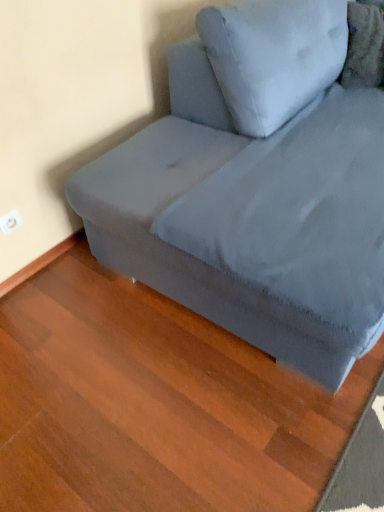
The width and height of the screenshot is (384, 512). Describe the element at coordinates (256, 189) in the screenshot. I see `velvet gray couch at upper right` at that location.

This screenshot has height=512, width=384. Identify the location of velvet gray couch at upper right. (256, 189).

Measure the distance between point (356, 63) and camera.

Point (356, 63) is 5.94 feet away from camera.

Locate an element on the screen. The width and height of the screenshot is (384, 512). velvety gray pillow at upper right is located at coordinates (364, 45).

What do you see at coordinates (364, 45) in the screenshot? The width and height of the screenshot is (384, 512). I see `velvety gray pillow at upper right` at bounding box center [364, 45].

Find the location of a particular element. The height and width of the screenshot is (512, 384). velvet gray couch at upper right is located at coordinates (256, 189).

Is velvety gray pillow at upper right at the right side of velvet gray couch at upper right?

Correct, you'll find velvety gray pillow at upper right to the right of velvet gray couch at upper right.

Is velvety gray pillow at upper right further to camera compared to velvet gray couch at upper right?

Yes, the depth of velvety gray pillow at upper right is greater than that of velvet gray couch at upper right.

Is point (378, 32) positioned in front of point (310, 236)?

No, (378, 32) is further to viewer.

From the image's perspective, is velvety gray pillow at upper right on velvet gray couch at upper right?

Indeed, from the image's perspective, velvety gray pillow at upper right is shown above velvet gray couch at upper right.

From a real-world perspective, between velvety gray pillow at upper right and velvet gray couch at upper right, who is vertically lower?

velvet gray couch at upper right.

Which of these two, velvety gray pillow at upper right or velvet gray couch at upper right, is thinner?

Thinner between the two is velvety gray pillow at upper right.

Considering the sizes of objects velvety gray pillow at upper right and velvet gray couch at upper right in the image provided, who is taller, velvety gray pillow at upper right or velvet gray couch at upper right?

velvet gray couch at upper right is taller.

Is velvety gray pillow at upper right bigger than velvet gray couch at upper right?

No.

Is velvety gray pillow at upper right inside or outside of velvet gray couch at upper right?

velvety gray pillow at upper right exists entirely within velvet gray couch at upper right.

From the picture: Is velvety gray pillow at upper right placed right next to velvet gray couch at upper right?

velvety gray pillow at upper right and velvet gray couch at upper right are clearly separated.

Could you tell me if velvety gray pillow at upper right is facing velvet gray couch at upper right?

Yes.

How much distance is there between velvety gray pillow at upper right and velvet gray couch at upper right?

velvety gray pillow at upper right and velvet gray couch at upper right are 26.85 inches apart.

The image size is (384, 512). I want to click on pillow above the velvet gray couch at upper right (from a real-world perspective), so click(x=364, y=45).

Considering the relative positions of velvet gray couch at upper right and velvety gray pillow at upper right in the image provided, is velvet gray couch at upper right to the right of velvety gray pillow at upper right from the viewer's perspective?

Incorrect, velvet gray couch at upper right is not on the right side of velvety gray pillow at upper right.

Which is behind, velvet gray couch at upper right or velvety gray pillow at upper right?

Positioned behind is velvety gray pillow at upper right.

Is point (378, 230) behind point (357, 12)?

No, it is in front of (357, 12).

From the image's perspective, is velvet gray couch at upper right located above velvety gray pillow at upper right?

Actually, velvet gray couch at upper right appears below velvety gray pillow at upper right in the image.

From a real-world perspective, is velvet gray couch at upper right below velvety gray pillow at upper right?

Yes, from a real-world perspective, velvet gray couch at upper right is below velvety gray pillow at upper right.

Does velvet gray couch at upper right have a lesser width compared to velvety gray pillow at upper right?

No, velvet gray couch at upper right is not thinner than velvety gray pillow at upper right.

Considering the relative sizes of velvet gray couch at upper right and velvety gray pillow at upper right in the image provided, is velvet gray couch at upper right shorter than velvety gray pillow at upper right?

No.

Considering the sizes of velvet gray couch at upper right and velvety gray pillow at upper right in the image, is velvet gray couch at upper right bigger or smaller than velvety gray pillow at upper right?

velvet gray couch at upper right is bigger than velvety gray pillow at upper right.

Would you say velvety gray pillow at upper right is part of velvet gray couch at upper right's contents?

Yes.

Would you consider velvet gray couch at upper right to be distant from velvety gray pillow at upper right?

No, velvet gray couch at upper right is in close proximity to velvety gray pillow at upper right.

Is velvet gray couch at upper right facing away from velvety gray pillow at upper right?

That's right, velvet gray couch at upper right is facing away from velvety gray pillow at upper right.

Locate an element on the screen. The width and height of the screenshot is (384, 512). pillow behind the velvet gray couch at upper right is located at coordinates (364, 45).

Find the location of a particular element. The width and height of the screenshot is (384, 512). pillow on the right of velvet gray couch at upper right is located at coordinates (364, 45).

Locate an element on the screen. Image resolution: width=384 pixels, height=512 pixels. pillow located above the velvet gray couch at upper right (from a real-world perspective) is located at coordinates (364, 45).